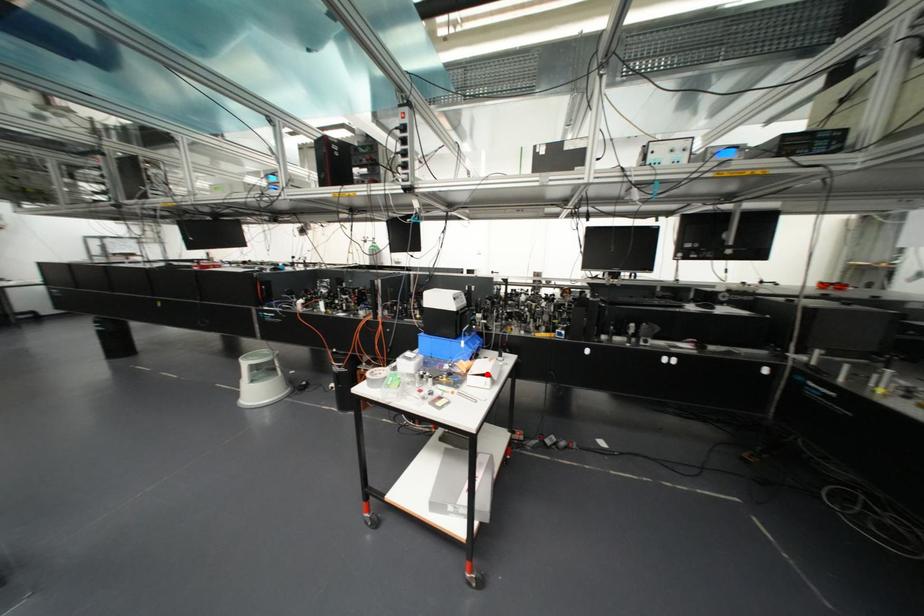
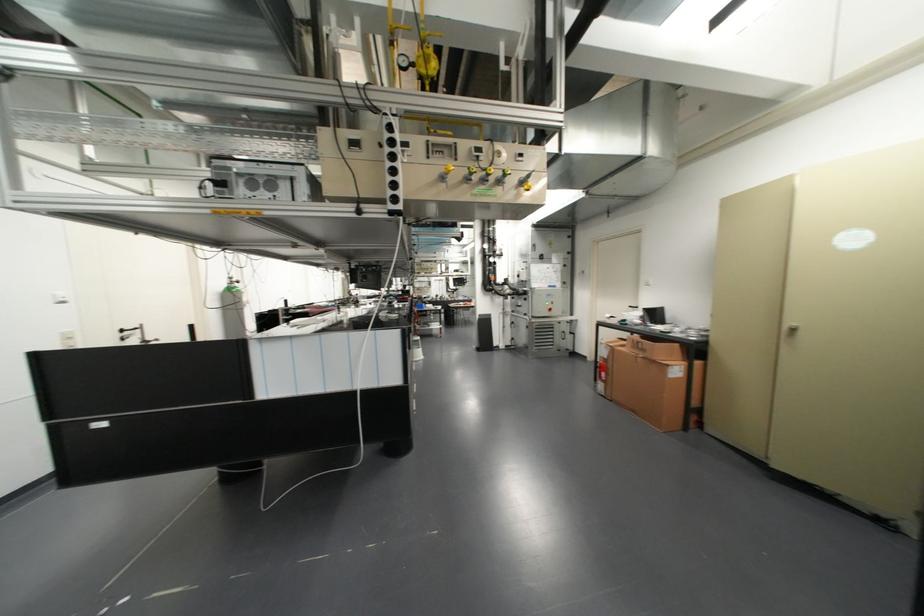
Question: I am providing you with two images of the same scene from different viewpoints. A red point is marked on the first image. Can you still see the location of the red point in image 2?

Choices:
 (A) Yes
 (B) No

Answer: (B)